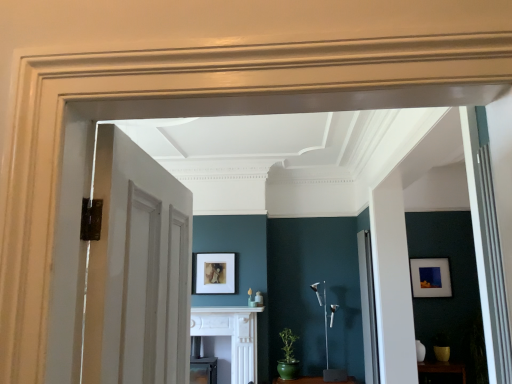
Question: From the image's perspective, does white marble fireplace at center appear higher than matte black picture frame at right, which is the first picture frame in back-to-front order?

Choices:
 (A) yes
 (B) no

Answer: (B)

Question: Is matte black picture frame at right, which is the first picture frame in back-to-front order, at the back of white marble fireplace at center?

Choices:
 (A) yes
 (B) no

Answer: (B)

Question: Considering the relative sizes of white marble fireplace at center and matte black picture frame at right, placed as the 1th picture frame when sorted from right to left, in the image provided, is white marble fireplace at center taller than matte black picture frame at right, placed as the 1th picture frame when sorted from right to left,?

Choices:
 (A) no
 (B) yes

Answer: (A)

Question: From a real-world perspective, does white marble fireplace at center sit lower than matte black picture frame at right, placed as the 1th picture frame when sorted from right to left?

Choices:
 (A) yes
 (B) no

Answer: (A)

Question: Considering the relative sizes of white marble fireplace at center and matte black picture frame at right, the second picture frame when ordered from left to right, in the image provided, is white marble fireplace at center smaller than matte black picture frame at right, the second picture frame when ordered from left to right,?

Choices:
 (A) no
 (B) yes

Answer: (A)

Question: Does white marble fireplace at center turn towards matte black picture frame at right, the second picture frame when ordered from left to right?

Choices:
 (A) yes
 (B) no

Answer: (B)

Question: Considering the relative sizes of brown wooden shelf at lower right and white glossy door at right, the 2th door in the front-to-back sequence, in the image provided, is brown wooden shelf at lower right smaller than white glossy door at right, the 2th door in the front-to-back sequence,?

Choices:
 (A) no
 (B) yes

Answer: (B)

Question: Considering the relative sizes of brown wooden shelf at lower right and white glossy door at right, which is counted as the 1th door, starting from the bottom, in the image provided, is brown wooden shelf at lower right shorter than white glossy door at right, which is counted as the 1th door, starting from the bottom,?

Choices:
 (A) yes
 (B) no

Answer: (A)

Question: From a real-world perspective, is brown wooden shelf at lower right beneath white glossy door at right, the 1th door in the right-to-left sequence?

Choices:
 (A) yes
 (B) no

Answer: (A)

Question: Is brown wooden shelf at lower right to the left of white glossy door at right, the second door viewed from the left, from the viewer's perspective?

Choices:
 (A) no
 (B) yes

Answer: (A)

Question: Can you confirm if brown wooden shelf at lower right is wider than white glossy door at right, which is the 2th door from top to bottom?

Choices:
 (A) yes
 (B) no

Answer: (A)

Question: Can you confirm if brown wooden shelf at lower right is bigger than white glossy door at right, the second door viewed from the left?

Choices:
 (A) yes
 (B) no

Answer: (B)

Question: Is white wood door at left, the 1th door positioned from the left, oriented away from brown wooden shelf at lower right?

Choices:
 (A) no
 (B) yes

Answer: (A)